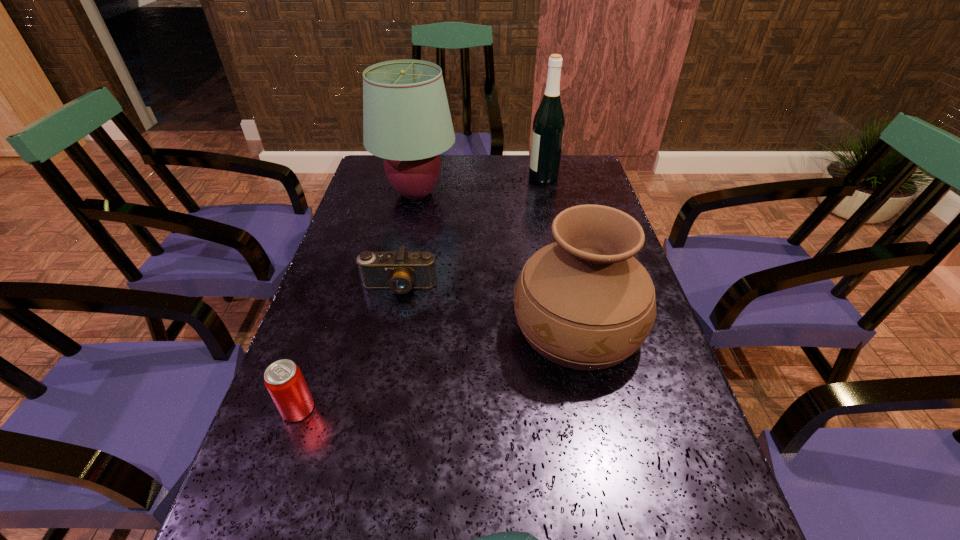
Locate an element on the screen. free space located on the left of the third tallest object is located at coordinates (422, 327).

This screenshot has height=540, width=960. Find the location of `vacant space located 0.310m on the back of the fifth farthest object`. vacant space located 0.310m on the back of the fifth farthest object is located at coordinates (340, 286).

What are the coordinates of `free spot located on the lens of the camera` in the screenshot? It's located at (369, 437).

I want to click on wine bottle positioned at the far edge, so click(549, 122).

Where is `lampshade situated at the far edge`? The image size is (960, 540). lampshade situated at the far edge is located at coordinates (406, 118).

Locate an element on the screen. lampshade that is at the left edge is located at coordinates (406, 118).

This screenshot has height=540, width=960. Identify the location of can positioned at the left edge. (283, 379).

This screenshot has height=540, width=960. Identify the location of camera that is positioned at the left edge. (401, 271).

Where is `wine bottle that is at the right edge`? wine bottle that is at the right edge is located at coordinates (549, 122).

Identify the location of urn that is at the right edge. (584, 302).